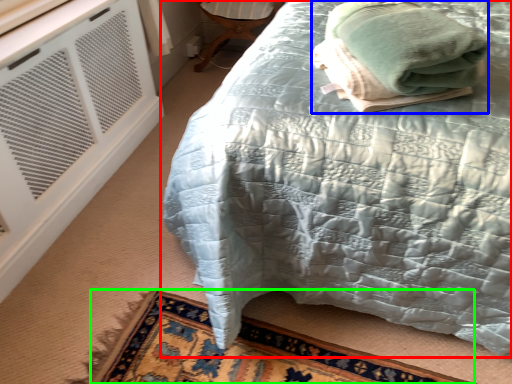
Question: Which object is the farthest from bed (highlighted by a red box)? Choose among these: bath towel (highlighted by a blue box) or mat (highlighted by a green box).

Choices:
 (A) bath towel
 (B) mat

Answer: (B)